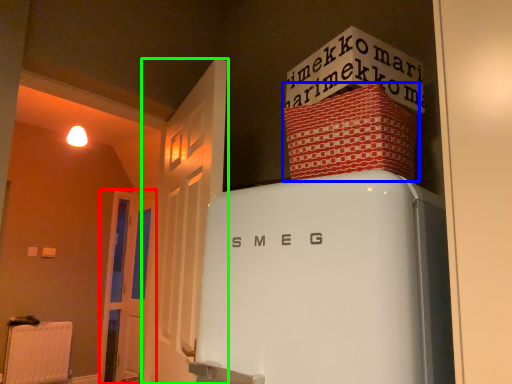
Question: Based on their relative distances, which object is nearer to door (highlighted by a red box)? Choose from cardboard box (highlighted by a blue box) and door (highlighted by a green box).

Choices:
 (A) cardboard box
 (B) door

Answer: (B)